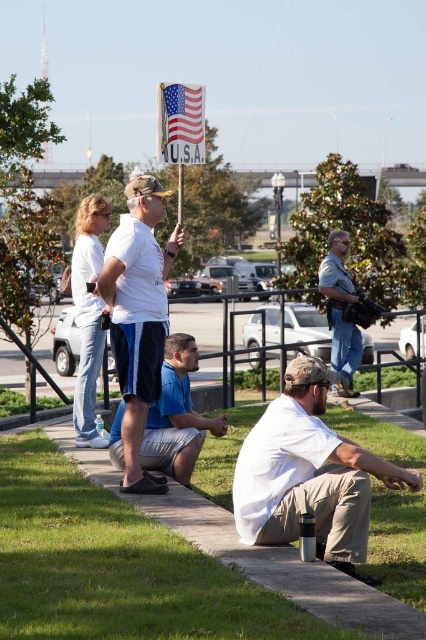
Question: Does green grass at lower center appear on the left side of american flag at upper center?

Choices:
 (A) no
 (B) yes

Answer: (B)

Question: Where is white matte shirt at lower right located in relation to white cotton t-shirt at center in the image?

Choices:
 (A) right
 (B) left

Answer: (A)

Question: Which of the following is the closest to the observer?

Choices:
 (A) (154, 250)
 (B) (345, 376)
 (C) (261, 588)
 (D) (242, 525)

Answer: (C)

Question: Which point appears farthest from the camera in this image?

Choices:
 (A) (299, 368)
 (B) (152, 381)
 (C) (120, 403)

Answer: (C)

Question: From the image, what is the correct spatial relationship of white matte shirt at lower right in relation to american flag at upper center?

Choices:
 (A) above
 (B) below

Answer: (B)

Question: Which of these objects is positioned farthest from the green grass at lower center?

Choices:
 (A) white matte shirt at lower right
 (B) american flag at upper center
 (C) white cotton t-shirt at center
 (D) blue shorts at center

Answer: (B)